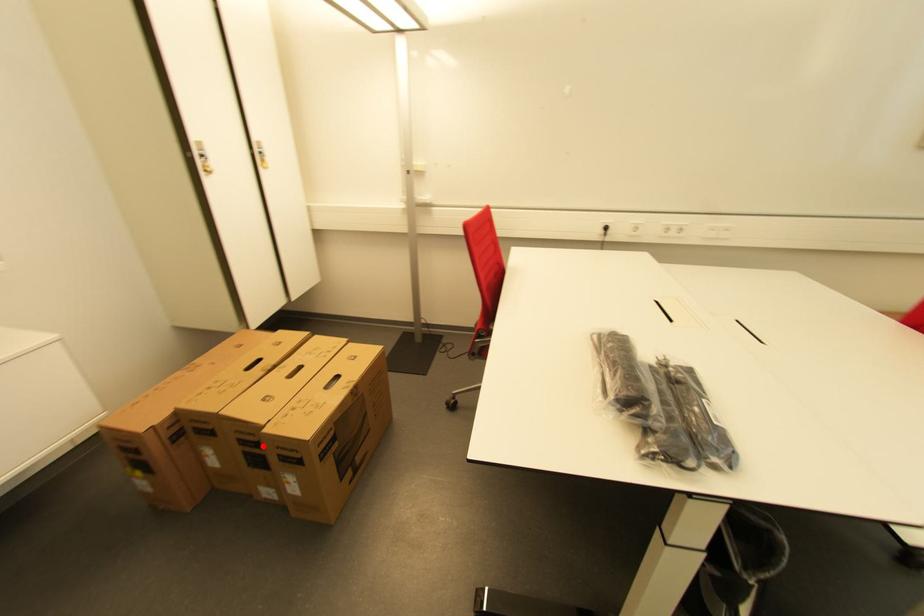
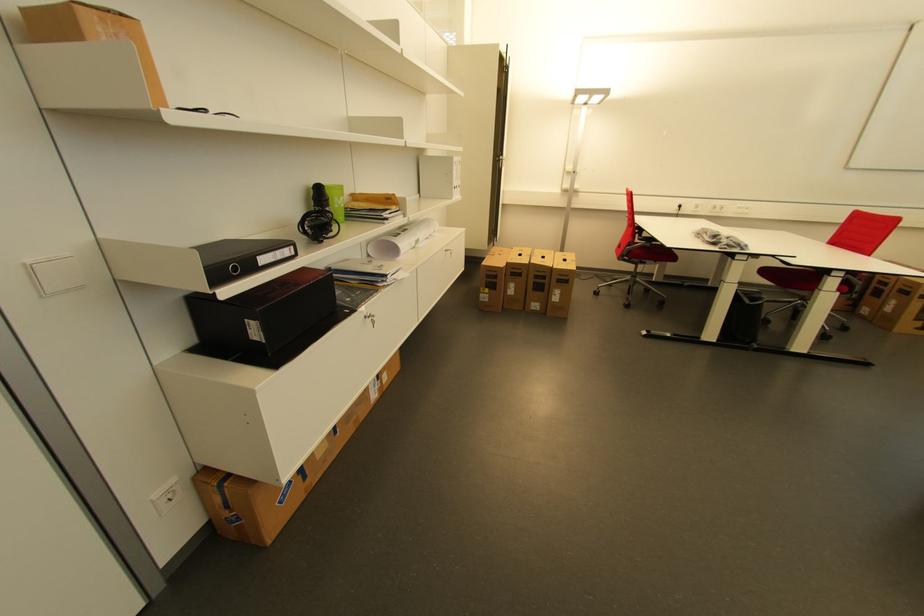
Question: I am providing you with two images of the same scene from different viewpoints. A red point is shown in image1. For the corresponding object point in image2, is it positioned nearer or farther from the camera?

Choices:
 (A) Nearer
 (B) Farther

Answer: (A)